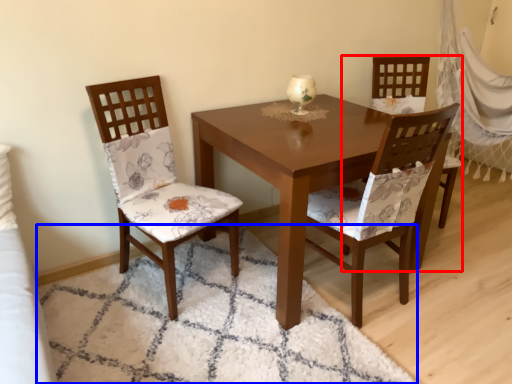
Question: Which object appears farthest to the camera in this image, chair (highlighted by a red box) or mat (highlighted by a blue box)?

Choices:
 (A) chair
 (B) mat

Answer: (A)